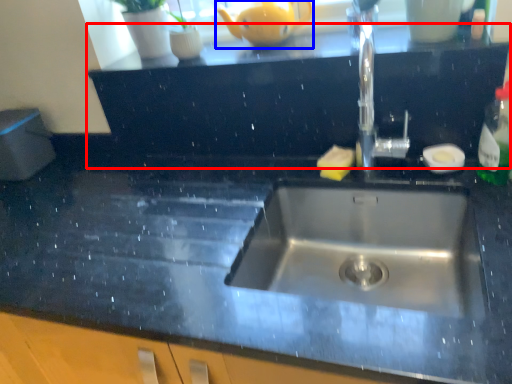
Question: Which object is closer to the camera taking this photo, dresser (highlighted by a red box) or tea pot (highlighted by a blue box)?

Choices:
 (A) dresser
 (B) tea pot

Answer: (A)